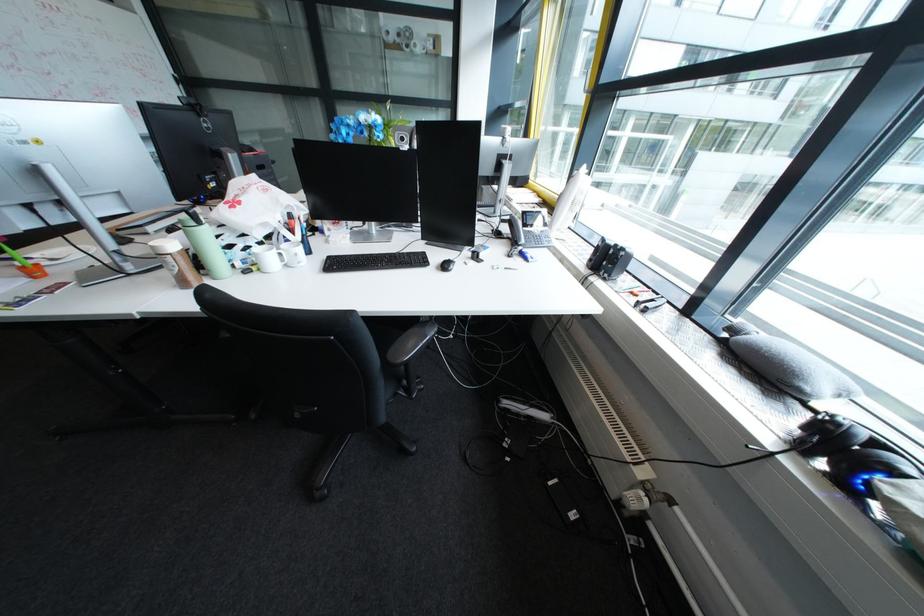
The location [208,249] corresponds to which object?

It corresponds to the light green bottle in the image.